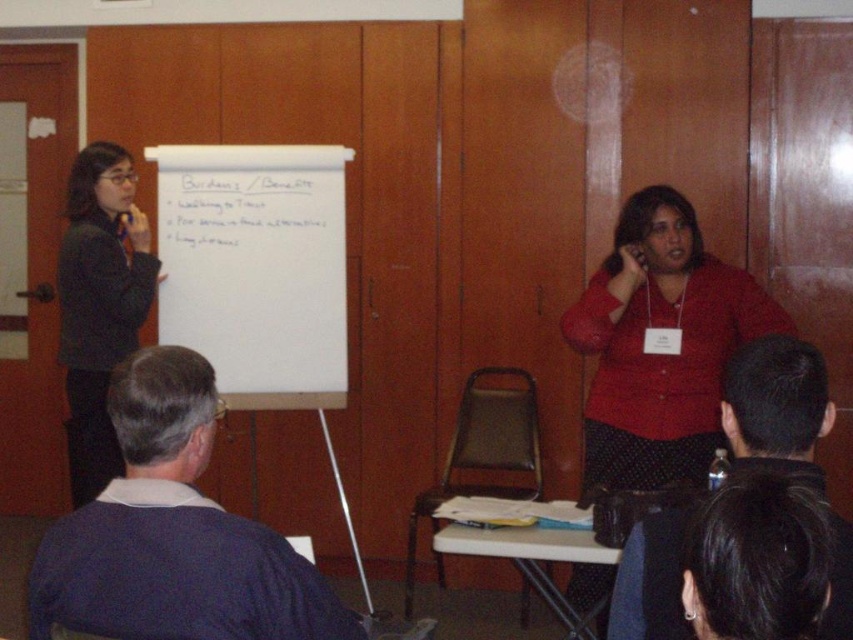
Is matte black jacket at left below white paper at upper center?

Indeed, matte black jacket at left is positioned under white paper at upper center.

Is matte black jacket at left smaller than white paper at upper center?

No, matte black jacket at left is not smaller than white paper at upper center.

Locate an element on the screen. matte black jacket at left is located at coordinates 99,305.

Does point (302, 205) lie behind point (248, 200)?

Yes, it is.

Who is positioned more to the left, whiteboard at upper left or white paper at upper center?

white paper at upper center

Find the location of `whiteboard at upper left`. whiteboard at upper left is located at coordinates (256, 268).

Is dark blue sweater at left positioned at the back of black fabric shirt at upper center?

That is True.

Who is more forward, (297,589) or (747,403)?

Point (297,589)

Which is behind, point (166, 499) or point (830, 403)?

Point (830, 403)

The image size is (853, 640). I want to click on dark blue sweater at left, so pos(173,532).